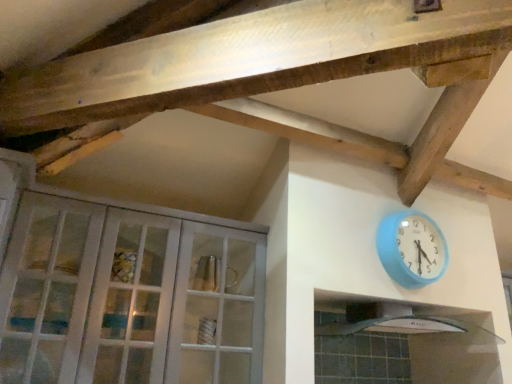
Question: Is white glossy exhaust hood at lower right positioned in front of blue plastic wall clock at upper right?

Choices:
 (A) yes
 (B) no

Answer: (A)

Question: Are white glossy exhaust hood at lower right and blue plastic wall clock at upper right beside each other?

Choices:
 (A) no
 (B) yes

Answer: (A)

Question: Is white glossy exhaust hood at lower right to the left of blue plastic wall clock at upper right from the viewer's perspective?

Choices:
 (A) yes
 (B) no

Answer: (A)

Question: Considering the relative sizes of white glossy exhaust hood at lower right and blue plastic wall clock at upper right in the image provided, is white glossy exhaust hood at lower right wider than blue plastic wall clock at upper right?

Choices:
 (A) yes
 (B) no

Answer: (A)

Question: Is white glossy exhaust hood at lower right outside blue plastic wall clock at upper right?

Choices:
 (A) no
 (B) yes

Answer: (B)

Question: Is white glossy exhaust hood at lower right in front of or behind blue plastic wall clock at upper right in the image?

Choices:
 (A) behind
 (B) front

Answer: (B)

Question: Considering the positions of white glossy exhaust hood at lower right and blue plastic wall clock at upper right in the image, is white glossy exhaust hood at lower right bigger or smaller than blue plastic wall clock at upper right?

Choices:
 (A) big
 (B) small

Answer: (A)

Question: From the image's perspective, is white glossy exhaust hood at lower right located above or below blue plastic wall clock at upper right?

Choices:
 (A) below
 (B) above

Answer: (A)

Question: From a real-world perspective, relative to blue plastic wall clock at upper right, is white glossy exhaust hood at lower right vertically above or below?

Choices:
 (A) below
 (B) above

Answer: (A)

Question: From the image's perspective, is white glass cabinet at left positioned above or below white glossy exhaust hood at lower right?

Choices:
 (A) above
 (B) below

Answer: (A)

Question: From a real-world perspective, relative to white glossy exhaust hood at lower right, is white glass cabinet at left vertically above or below?

Choices:
 (A) above
 (B) below

Answer: (A)

Question: Considering the positions of white glass cabinet at left and white glossy exhaust hood at lower right in the image, is white glass cabinet at left taller or shorter than white glossy exhaust hood at lower right?

Choices:
 (A) short
 (B) tall

Answer: (B)

Question: Is white glass cabinet at left inside the boundaries of white glossy exhaust hood at lower right, or outside?

Choices:
 (A) outside
 (B) inside

Answer: (A)

Question: Looking at their shapes, would you say white glass cabinet at left is wider or thinner than blue plastic wall clock at upper right?

Choices:
 (A) thin
 (B) wide

Answer: (B)

Question: Which is correct: white glass cabinet at left is inside blue plastic wall clock at upper right, or outside of it?

Choices:
 (A) outside
 (B) inside

Answer: (A)